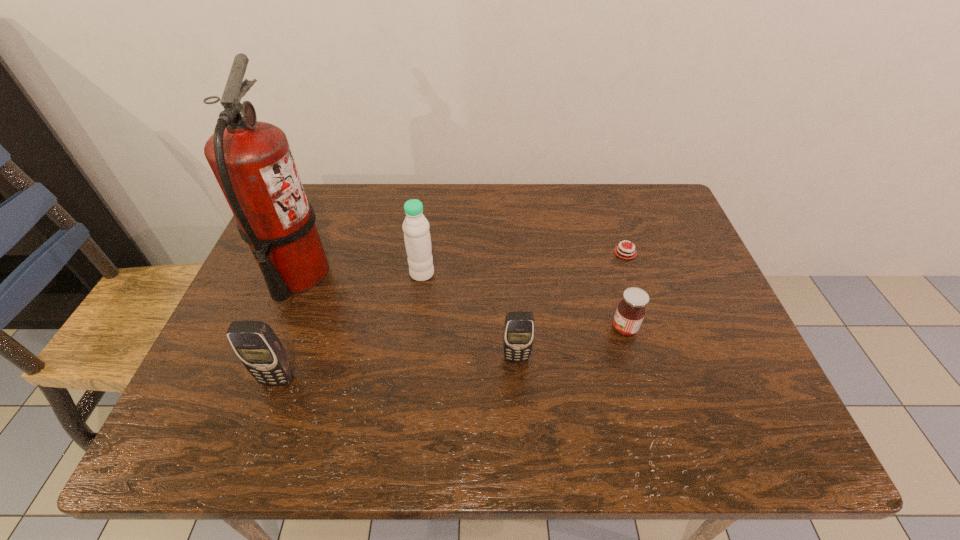
The width and height of the screenshot is (960, 540). Identify the location of the taller cellular telephone. (260, 350).

The width and height of the screenshot is (960, 540). I want to click on the left cellular telephone, so click(260, 350).

This screenshot has height=540, width=960. Identify the location of the right cellular telephone. (519, 328).

The width and height of the screenshot is (960, 540). Identify the location of the third object from right to left. (519, 328).

You are a GUI agent. You are given a task and a screenshot of the screen. Output one action in this format:
    pyautogui.click(x=<x>, y=<y>)
    Task: Click on the water bottle
    
    Given the screenshot: What is the action you would take?
    pyautogui.click(x=417, y=238)

Identify the location of the second tallest object. (417, 238).

What are the coordinates of `fire extinguisher` in the screenshot? It's located at (252, 161).

The width and height of the screenshot is (960, 540). Find the location of `the shortest object`. the shortest object is located at coordinates (622, 251).

Find the location of a particular element. the third nearest object is located at coordinates (630, 312).

I want to click on jam, so click(630, 312).